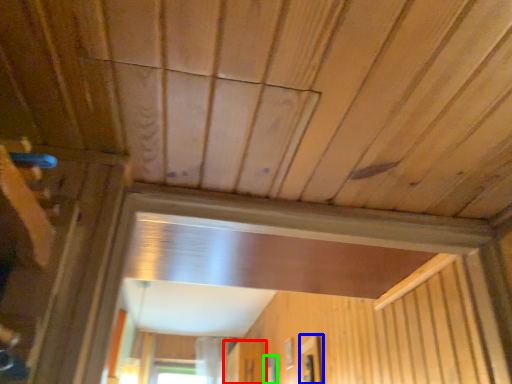
Question: Which object is positioned closest to screen door (highlighted by a red box)? Select from window (highlighted by a blue box) and window (highlighted by a green box).

Choices:
 (A) window
 (B) window

Answer: (B)